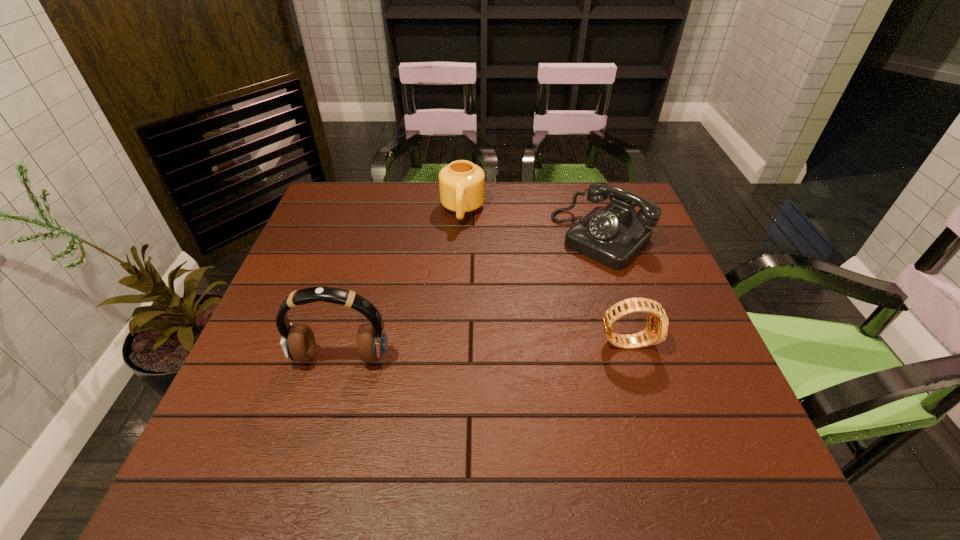
Find the location of a particular element. free point between the telephone and the watch is located at coordinates (614, 289).

Image resolution: width=960 pixels, height=540 pixels. What are the coordinates of `empty space that is in between the second object from left to right and the telephone` in the screenshot? It's located at (532, 224).

Locate an element on the screen. vacant space in between the watch and the headset is located at coordinates (484, 350).

Identify which object is the second nearest to the headset. Please provide its 2D coordinates. Your answer should be formatted as a tuple, i.e. [(x, y)], where the tuple contains the x and y coordinates of a point satisfying the conditions above.

[(656, 331)]

Identify the location of object that stands as the second closest to the third object from right to left. (298, 342).